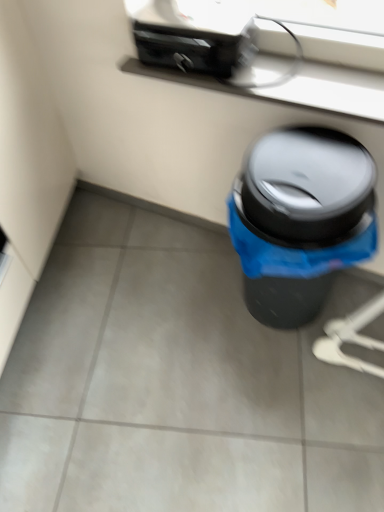
Question: From the image's perspective, does satin black window sill at upper center appear lower than black plastic trash can at lower right?

Choices:
 (A) yes
 (B) no

Answer: (B)

Question: Does satin black window sill at upper center have a larger size compared to black plastic trash can at lower right?

Choices:
 (A) yes
 (B) no

Answer: (B)

Question: Is satin black window sill at upper center at the left side of black plastic trash can at lower right?

Choices:
 (A) yes
 (B) no

Answer: (A)

Question: From the image's perspective, is satin black window sill at upper center above black plastic trash can at lower right?

Choices:
 (A) no
 (B) yes

Answer: (B)

Question: Can you confirm if satin black window sill at upper center is smaller than black plastic trash can at lower right?

Choices:
 (A) no
 (B) yes

Answer: (B)

Question: From a real-world perspective, is black plastic trash can at lower right above or below satin black window sill at upper center?

Choices:
 (A) below
 (B) above

Answer: (A)

Question: From the image's perspective, is black plastic trash can at lower right positioned above or below satin black window sill at upper center?

Choices:
 (A) below
 (B) above

Answer: (A)

Question: In terms of size, does black plastic trash can at lower right appear bigger or smaller than satin black window sill at upper center?

Choices:
 (A) big
 (B) small

Answer: (A)

Question: Visually, is black plastic trash can at lower right positioned to the left or to the right of satin black window sill at upper center?

Choices:
 (A) left
 (B) right

Answer: (B)

Question: From their relative heights in the image, would you say black plastic toaster at upper center is taller or shorter than satin black window sill at upper center?

Choices:
 (A) tall
 (B) short

Answer: (A)

Question: Considering their positions, is black plastic toaster at upper center located in front of or behind satin black window sill at upper center?

Choices:
 (A) behind
 (B) front

Answer: (A)

Question: Is point (235, 53) positioned closer to the camera than point (329, 68)?

Choices:
 (A) closer
 (B) farther

Answer: (A)

Question: From a real-world perspective, is black plastic toaster at upper center physically located above or below satin black window sill at upper center?

Choices:
 (A) below
 (B) above

Answer: (B)

Question: Considering the positions of point (251, 208) and point (211, 57), is point (251, 208) closer or farther from the camera than point (211, 57)?

Choices:
 (A) farther
 (B) closer

Answer: (B)

Question: Is black plastic trash can at lower right in front of or behind black plastic toaster at upper center in the image?

Choices:
 (A) front
 (B) behind

Answer: (A)